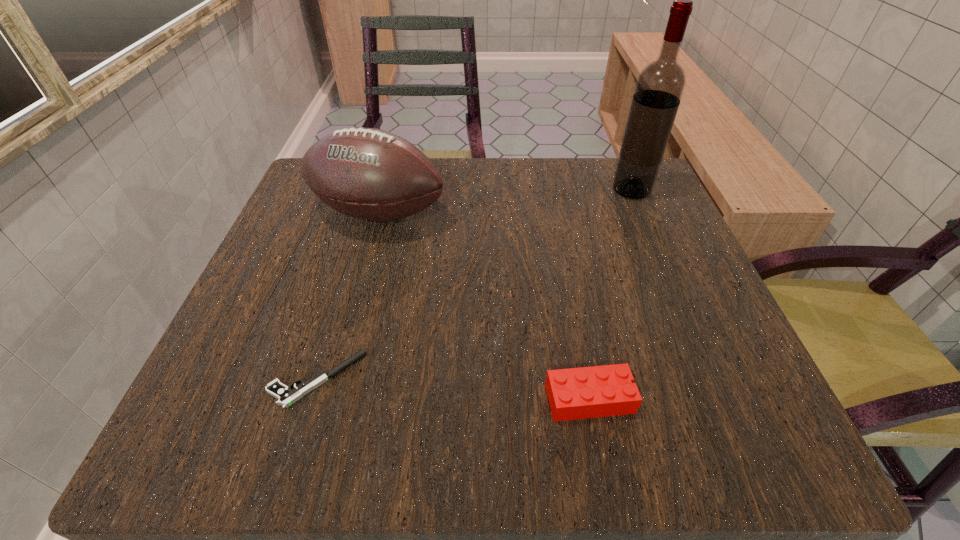
This screenshot has height=540, width=960. What are the coordinates of `football (American) present at the far edge` in the screenshot? It's located at (370, 174).

In order to click on Lego present at the near edge in this screenshot , I will do `click(599, 391)`.

Where is `pistol at the near edge`? pistol at the near edge is located at coordinates (287, 396).

At what (x,y) coordinates should I click in order to perform the action: click on football (American) that is at the left edge. Please return your answer as a coordinate pair (x, y). The width and height of the screenshot is (960, 540). Looking at the image, I should click on (370, 174).

You are a GUI agent. You are given a task and a screenshot of the screen. Output one action in this format:
    pyautogui.click(x=<x>, y=<y>)
    Task: Click on the pistol present at the left edge
    
    Given the screenshot: What is the action you would take?
    pyautogui.click(x=287, y=396)

This screenshot has height=540, width=960. Find the location of `object that is at the right edge`. object that is at the right edge is located at coordinates (x=660, y=85).

Where is `object that is positioned at the far left corner`? The width and height of the screenshot is (960, 540). object that is positioned at the far left corner is located at coordinates (370, 174).

Where is `object present at the near left corner`? This screenshot has width=960, height=540. object present at the near left corner is located at coordinates (287, 396).

This screenshot has height=540, width=960. What are the coordinates of `object located in the far right corner section of the desktop` in the screenshot? It's located at (660, 85).

At what (x,y) coordinates should I click in order to perform the action: click on vacant space at the far edge of the desktop. Please return your answer as a coordinate pair (x, y). This screenshot has height=540, width=960. Looking at the image, I should click on (436, 203).